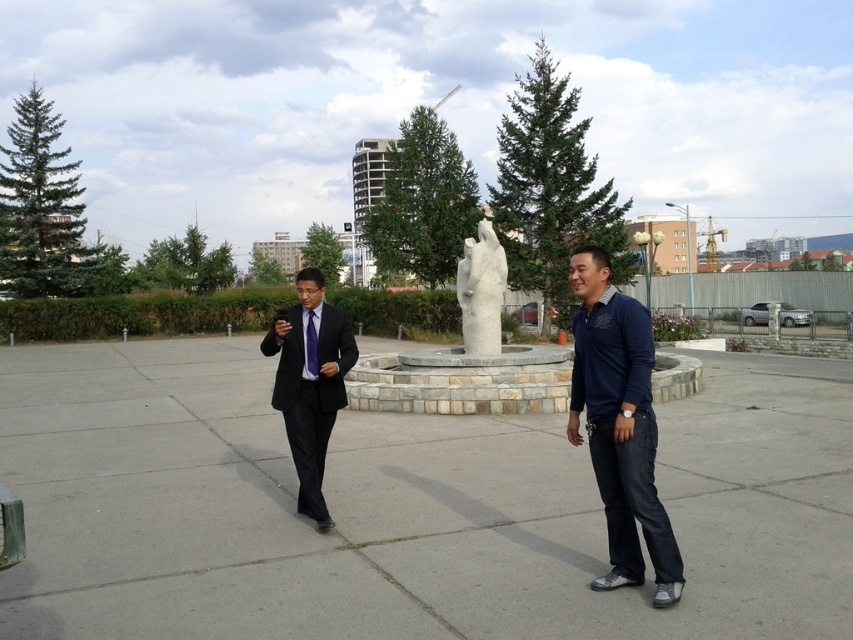
You are a photographer setting up a shot of the black suit at center and the purple silk tie at center. You want to ensure both subjects are in focus. Given that your camera has a depth of field that can cover 18 inches, will both subjects be in focus?

The distance between the black suit at center and the purple silk tie at center is 18.20 inches. Since the camera can cover 18 inches, the subjects are just slightly beyond the depth of field range. Therefore, both may not be fully in focus.

You are standing at the point marked as point [310,385] in the image. What is the color of the suit of the person standing at that point?

The point [310,385] corresponds to the black suit at center, so the color of the suit is black.